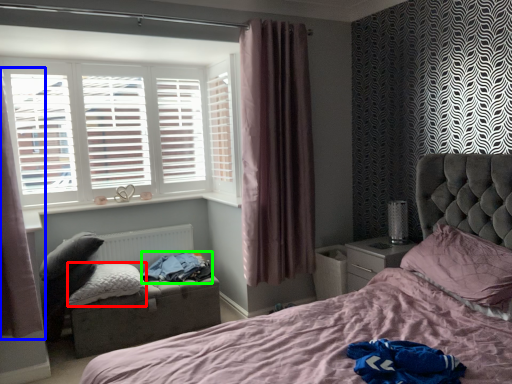
Question: Based on their relative distances, which object is farther from pillow (highlighted by a red box)? Choose from curtain (highlighted by a blue box) and clothing (highlighted by a green box).

Choices:
 (A) curtain
 (B) clothing

Answer: (A)